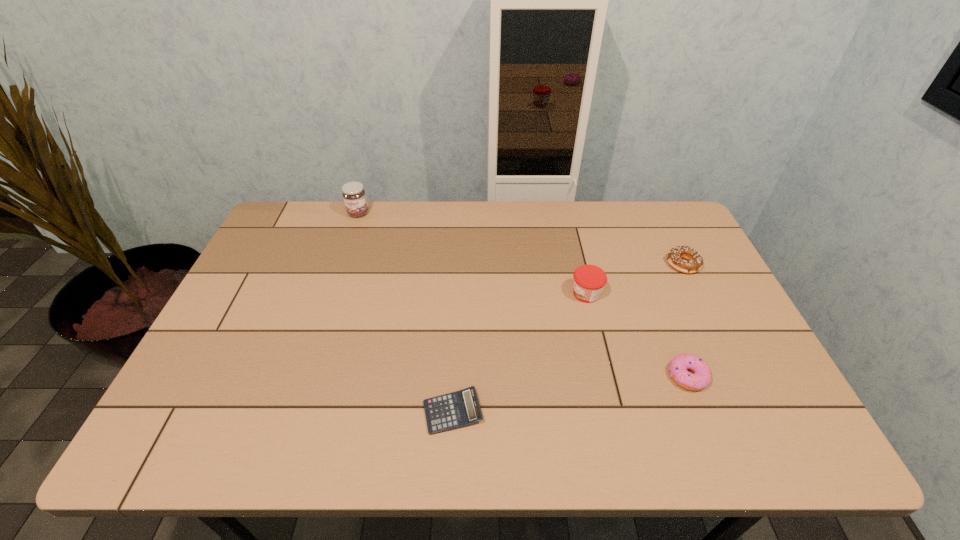
Identify the location of vacant area in the image that satisfies the following two spatial constraints: 1. on the label side of the left doughnut; 2. on the right side of the fourth shortest object. (606, 376).

This screenshot has height=540, width=960. I want to click on vacant point that satisfies the following two spatial constraints: 1. on the front label of the tallest object; 2. on the left side of the calculator, so click(292, 412).

Identify the location of free point that satisfies the following two spatial constraints: 1. on the back side of the second farthest object; 2. on the left side of the nearer doughnut. Image resolution: width=960 pixels, height=540 pixels. pyautogui.click(x=644, y=264).